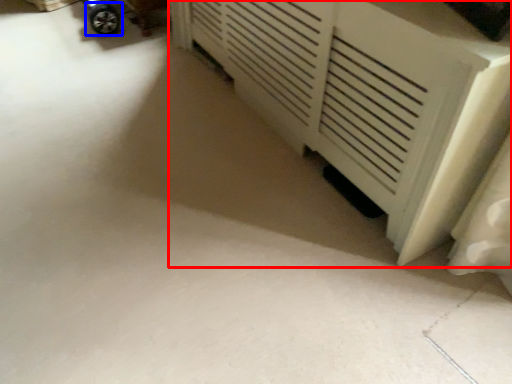
Question: Among these objects, which one is farthest to the camera, furniture (highlighted by a red box) or wheel (highlighted by a blue box)?

Choices:
 (A) furniture
 (B) wheel

Answer: (B)